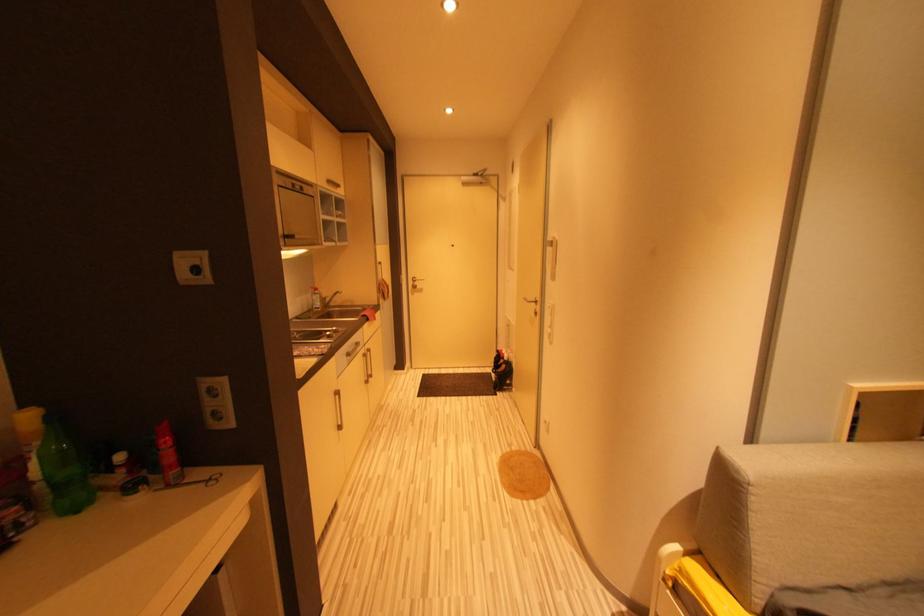
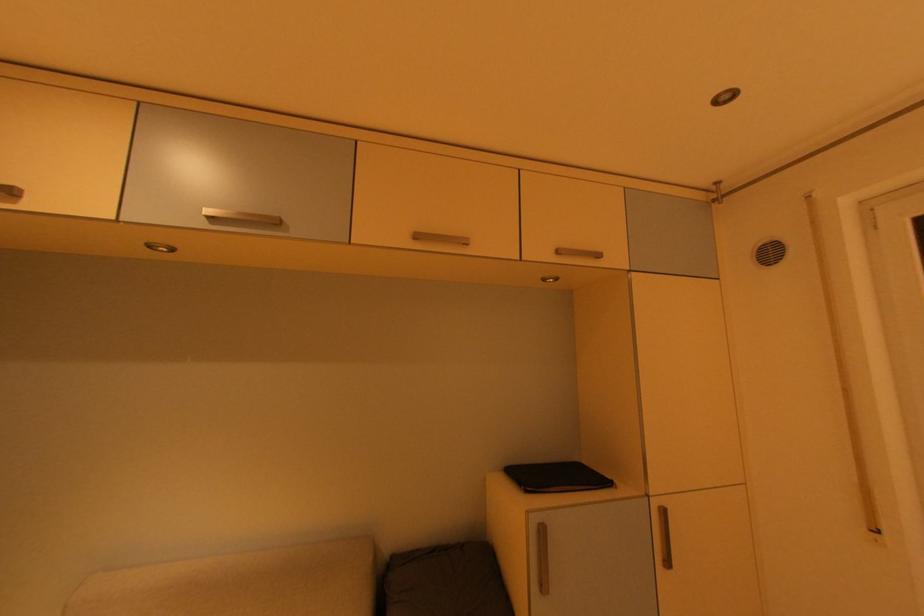
Question: The camera is either moving clockwise (left) or counter-clockwise (right) around the object. The first image is from the beginning of the video and the second image is from the end. Is the camera moving left or right when shooting the video?

Choices:
 (A) Left
 (B) Right

Answer: (A)